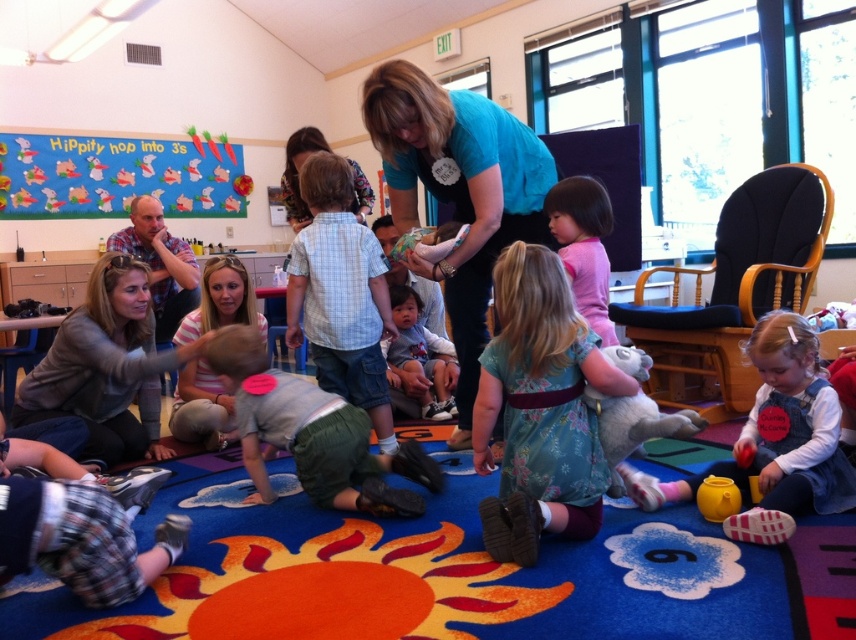
Question: Can you confirm if floral fabric dress at center is positioned below blue cotton shirt at center?

Choices:
 (A) yes
 (B) no

Answer: (A)

Question: Which point is farther to the camera?

Choices:
 (A) denim overalls at lower right
 (B) blue cotton shirt at center
 (C) pink matte dress at center
 (D) matte gray shirt at center

Answer: (D)

Question: Among these objects, which one is nearest to the camera?

Choices:
 (A) pink matte dress at center
 (B) matte gray shirt at center

Answer: (A)

Question: Is the position of gray cotton shirt at center less distant than that of matte gray shirt at center?

Choices:
 (A) no
 (B) yes

Answer: (B)

Question: Which object appears farthest from the camera in this image?

Choices:
 (A) floral fabric dress at center
 (B) striped cotton shirt at center

Answer: (B)

Question: Can you confirm if blue cotton shirt at center is positioned to the right of pink matte dress at center?

Choices:
 (A) no
 (B) yes

Answer: (A)